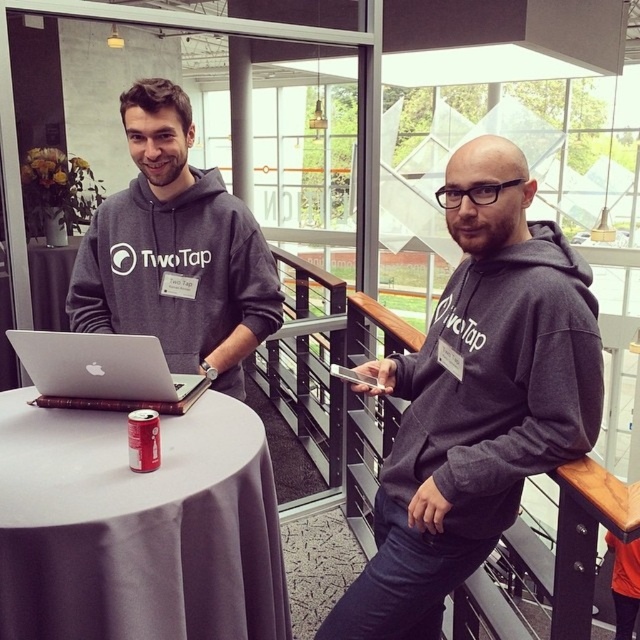
You are at a corporate event and need to locate the red matte can at table left. Where relative to the dark gray hoodie at center should you look?

The red matte can at table left is to the left of the dark gray hoodie at center.

Consider the image. You are at a corporate event and need to place a small gift on the white satin round table at center. The table is at coordinates point (138,528). If you are standing at point 0.5, 0.5, which direction should you move to reach the table?

The white satin round table at center is located at point (138,528). Since you are at point 0.5, 0.5, you should move northeast to reach the table.

You are a photographer trying to capture a clear shot of both the dark gray hoodie at center and the red matte can at table left. Since you want both objects in focus, you need to adjust your camera so that the depth of field can include both. Given their positions, is this possible without moving either object?

The dark gray hoodie at center is closer to the viewer than the red matte can at table left. To get both in focus, you would need to adjust the camera to have a larger depth of field or position yourself so that the distance between them is within the current depth of field range. However, since the hoodie is closer, achieving sharp focus on both might be challenging depending on the lens and aperture used.